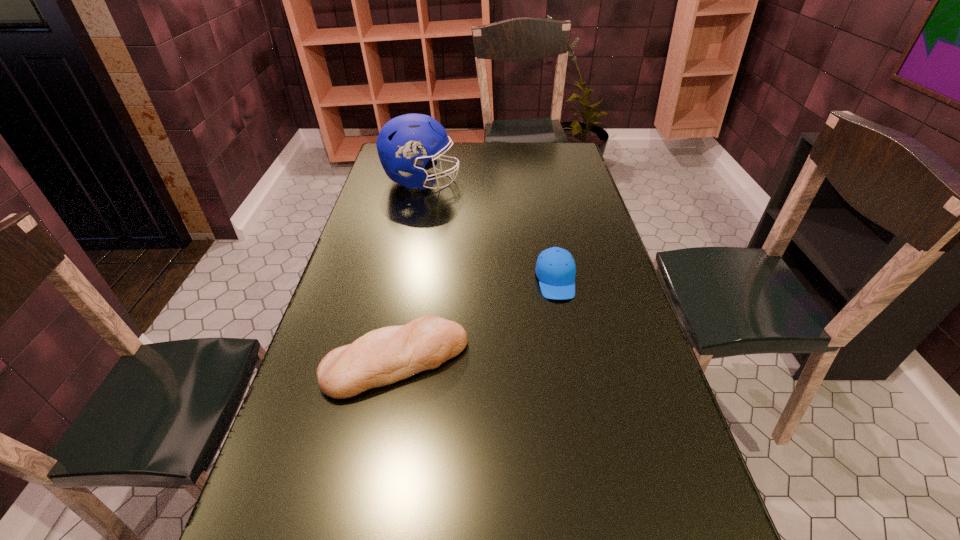
The height and width of the screenshot is (540, 960). I want to click on unoccupied position between the nearest object and the rightmost object, so click(x=476, y=321).

Identify the location of free spot between the second nearest object and the nearest object. (476, 321).

Identify the location of object that ranks as the second closest to the second farthest object. The height and width of the screenshot is (540, 960). click(403, 144).

Point out which object is positioned as the second nearest to the cap. Please provide its 2D coordinates. Your answer should be formatted as a tuple, i.e. [(x, y)], where the tuple contains the x and y coordinates of a point satisfying the conditions above.

[(403, 144)]

Locate an element on the screen. free space that satisfies the following two spatial constraints: 1. on the front-facing side of the football helmet; 2. on the right side of the nearest object is located at coordinates (385, 361).

Identify the location of free spot that satisfies the following two spatial constraints: 1. on the front-facing side of the bread; 2. on the left side of the tallest object. This screenshot has width=960, height=540. (385, 361).

In order to click on vacant point that satisfies the following two spatial constraints: 1. on the front-facing side of the nearest object; 2. on the right side of the football helmet in this screenshot , I will do `click(385, 361)`.

The height and width of the screenshot is (540, 960). Identify the location of vacant region that satisfies the following two spatial constraints: 1. on the front-facing side of the bread; 2. on the right side of the farthest object. (385, 361).